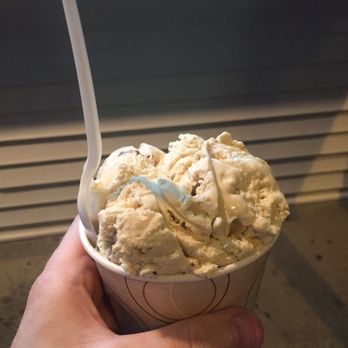
What are the coordinates of `cup` in the screenshot? It's located at (x=238, y=290).